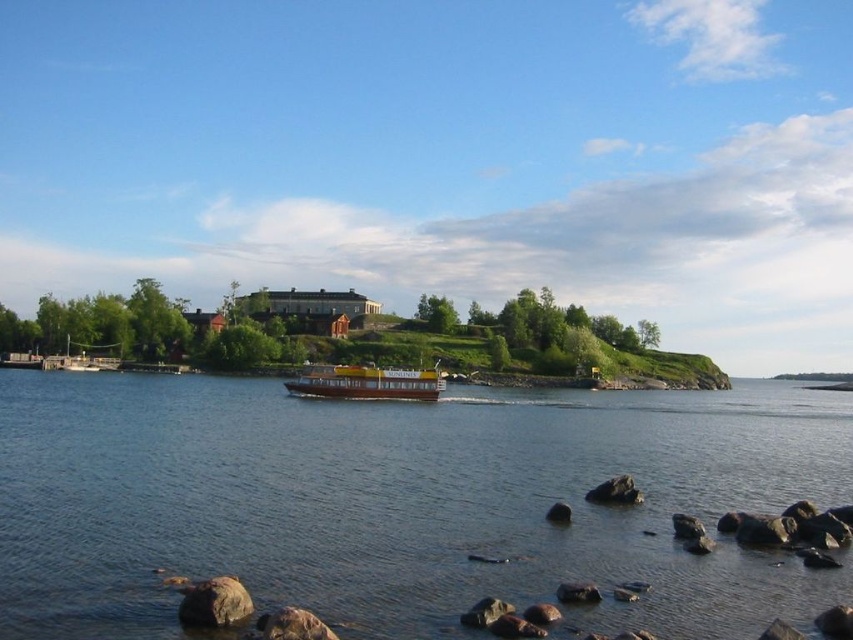
You are a photographer planning to capture the blue water at center and the yellow matte boat at center in a single frame. Based on the scene, which object occupies a wider area in the image?

The blue water at center occupies a wider area in the image since its width is larger than that of the yellow matte boat at center.

You are a photographer planning to take a photo of the blue water at center and the wooden dock at lower left. Which object appears taller in the image?

The wooden dock at lower left appears taller than the blue water at center in the image.

You are standing on the wooden dock at lower left and want to reach the blue water at center. Which direction should you move to get there?

The blue water at center is positioned on the right side of wooden dock at lower left, so you should move to the right to reach it.